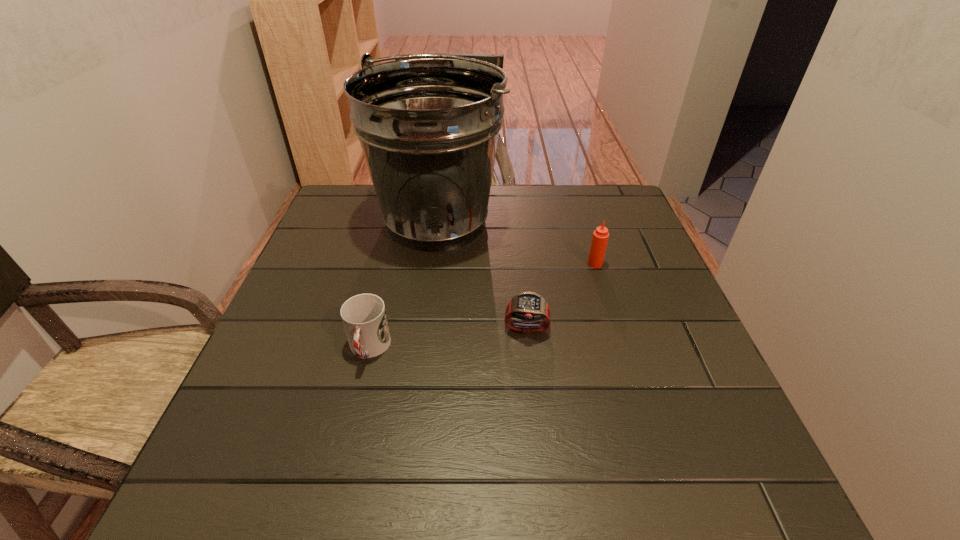
The width and height of the screenshot is (960, 540). I want to click on vacant region that satisfies the following two spatial constraints: 1. on the back side of the rightmost object; 2. on the left side of the watch, so click(x=519, y=264).

Where is `vacant area that satisfies the following two spatial constraints: 1. on the back side of the Tabasco sauce; 2. on the right side of the shortest object`? vacant area that satisfies the following two spatial constraints: 1. on the back side of the Tabasco sauce; 2. on the right side of the shortest object is located at coordinates (519, 264).